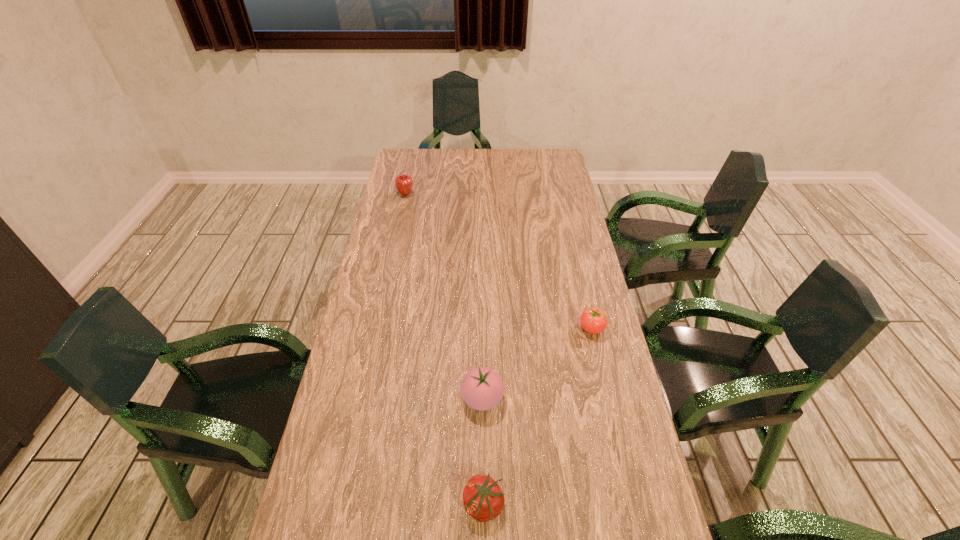
I want to click on the second nearest tomato, so click(x=482, y=388).

Identify the location of the tallest tomato. The width and height of the screenshot is (960, 540). (482, 388).

Where is `the farthest object`? The image size is (960, 540). the farthest object is located at coordinates (404, 182).

Locate an element on the screen. Image resolution: width=960 pixels, height=540 pixels. the leftmost object is located at coordinates (404, 182).

Identify the location of the second farthest object. The width and height of the screenshot is (960, 540). (593, 320).

Identify the location of the rightmost tomato. The height and width of the screenshot is (540, 960). click(593, 320).

Identify the location of the nearest tomato. (483, 499).

In order to click on vacant space located on the back of the third farthest object in this screenshot , I will do pos(482,357).

Where is `vacant space located 0.310m on the right of the apple`? This screenshot has width=960, height=540. vacant space located 0.310m on the right of the apple is located at coordinates (492, 194).

Locate an element on the screen. This screenshot has height=540, width=960. free space located on the front of the second farthest object is located at coordinates (614, 426).